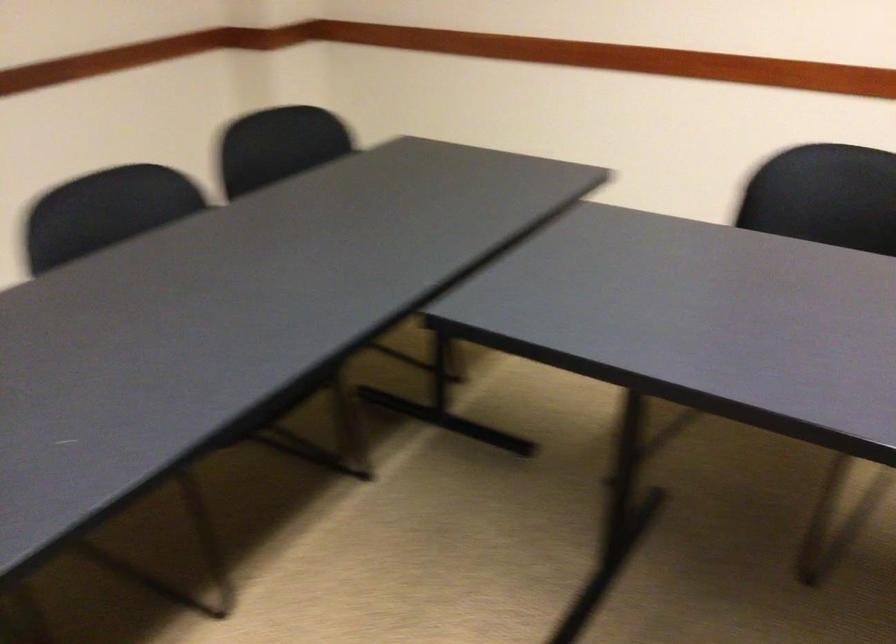
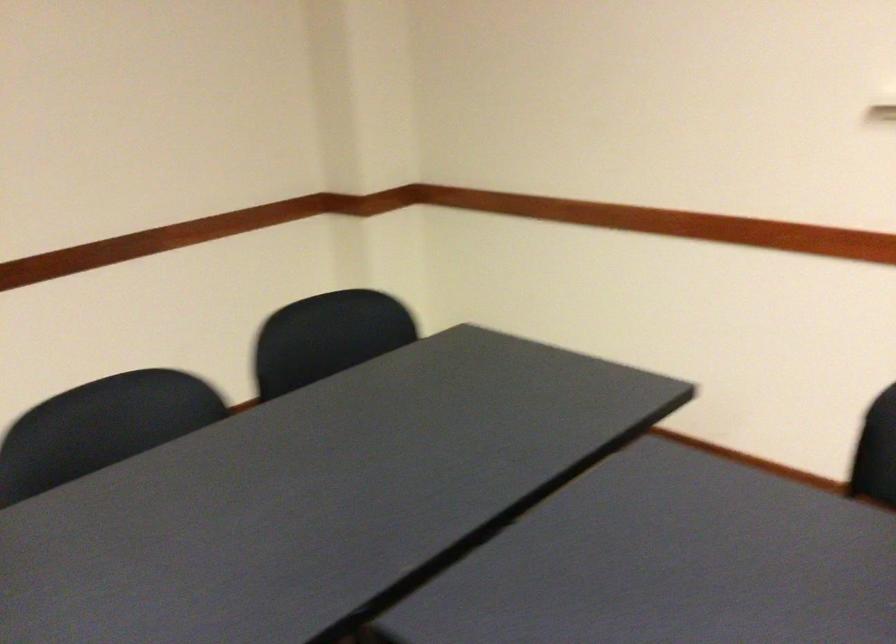
In a continuous first-person perspective shot, in which direction is the camera moving?

The movement direction of the cameraman is right, forward.